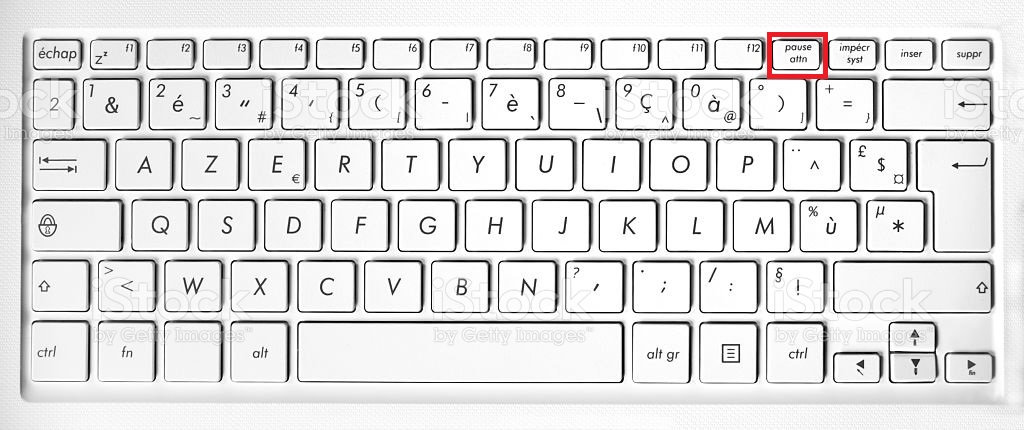
Where is `number keys on keyboard`? The height and width of the screenshot is (430, 1024). number keys on keyboard is located at coordinates pos(128,119), pos(195,120), pos(262,119), pos(328,119), pos(390,119), pos(465,117), pos(528,119), pos(596,119), pos(663,120), pos(729,116).